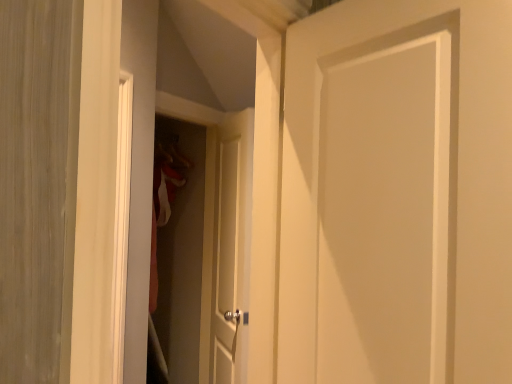
Question: Can you confirm if white matte door at center, the 1th door when ordered from front to back, is taller than white matte door at center, the 1th door in the left-to-right sequence?

Choices:
 (A) yes
 (B) no

Answer: (B)

Question: From the image's perspective, is white matte door at center, the 1th door when ordered from front to back, beneath white matte door at center, the 1th door in the back-to-front sequence?

Choices:
 (A) yes
 (B) no

Answer: (B)

Question: Is white matte door at center, the second door positioned from the right, inside white matte door at center, acting as the 1th door starting from the right?

Choices:
 (A) no
 (B) yes

Answer: (A)

Question: Is white matte door at center, the 1th door when ordered from front to back, looking in the opposite direction of white matte door at center, the 1th door in the back-to-front sequence?

Choices:
 (A) no
 (B) yes

Answer: (A)

Question: From a real-world perspective, does white matte door at center, placed as the second door when sorted from back to front, sit lower than white matte door at center, the second door positioned from the right?

Choices:
 (A) no
 (B) yes

Answer: (A)

Question: From the image's perspective, would you say white matte door at center, acting as the 1th door starting from the right, is positioned over white matte door at center, the 1th door in the left-to-right sequence?

Choices:
 (A) no
 (B) yes

Answer: (B)

Question: Is white matte door at center, the 2th door positioned from the front, turned away from white matte door at center, acting as the 1th door starting from the right?

Choices:
 (A) no
 (B) yes

Answer: (A)

Question: Is white matte door at center, the 1th door in the left-to-right sequence, touching white matte door at center, the 1th door when ordered from front to back?

Choices:
 (A) no
 (B) yes

Answer: (A)

Question: Can you confirm if white matte door at center, the second door positioned from the right, is shorter than white matte door at center, arranged as the second door when viewed from the left?

Choices:
 (A) no
 (B) yes

Answer: (A)

Question: Is white matte door at center, the 1th door in the left-to-right sequence, in front of white matte door at center, the 1th door when ordered from front to back?

Choices:
 (A) yes
 (B) no

Answer: (B)

Question: Is white matte door at center, the 1th door in the back-to-front sequence, facing towards white matte door at center, placed as the second door when sorted from back to front?

Choices:
 (A) no
 (B) yes

Answer: (A)

Question: Is white matte door at center, acting as the 1th door starting from the right, located within white matte door at center, the 1th door in the left-to-right sequence?

Choices:
 (A) yes
 (B) no

Answer: (B)

Question: Is matte white screen door at center outside white matte door at center, the 2th door positioned from the front?

Choices:
 (A) yes
 (B) no

Answer: (A)